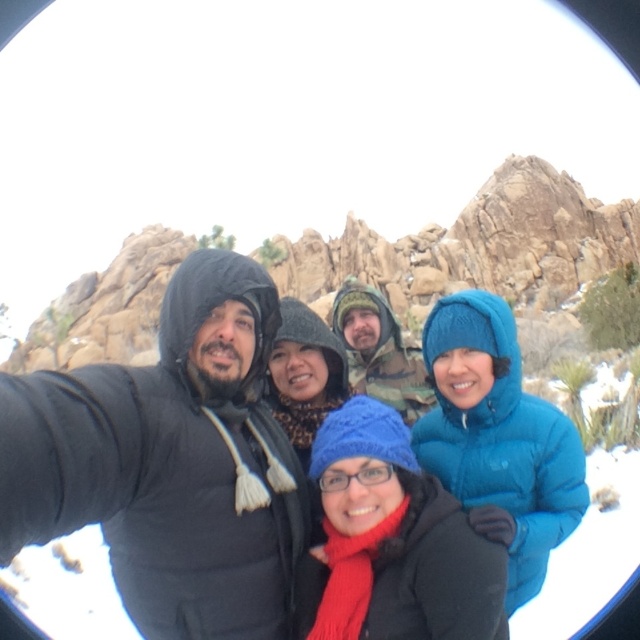
Question: Considering the relative positions of matte black jacket at center and knitted blue hat at center in the image provided, where is matte black jacket at center located with respect to knitted blue hat at center?

Choices:
 (A) below
 (B) above

Answer: (B)

Question: Is matte black jacket at center closer to the viewer compared to knitted blue hat at center?

Choices:
 (A) yes
 (B) no

Answer: (A)

Question: Which of the following is the closest to the observer?

Choices:
 (A) (208, 288)
 (B) (442, 525)

Answer: (B)

Question: Is matte black jacket at center in front of knitted blue hat at center?

Choices:
 (A) no
 (B) yes

Answer: (B)

Question: Among these objects, which one is nearest to the camera?

Choices:
 (A) knitted blue hat at center
 (B) matte black jacket at center

Answer: (B)

Question: Among these points, which one is farthest from the camera?

Choices:
 (A) (477, 596)
 (B) (154, 506)

Answer: (B)